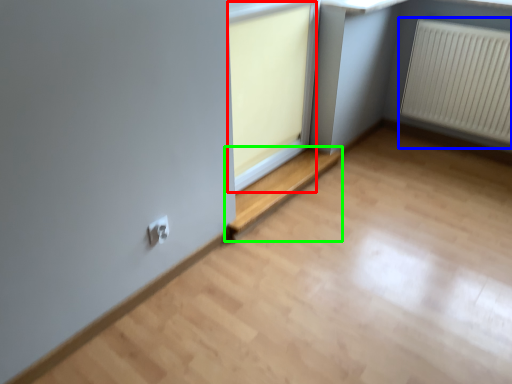
Question: Considering the real-world distances, which object is farthest from window frame (highlighted by a red box)? radiator (highlighted by a blue box) or window (highlighted by a green box)?

Choices:
 (A) radiator
 (B) window

Answer: (A)